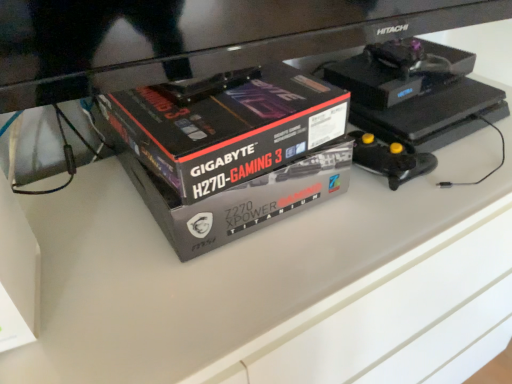
The image size is (512, 384). Describe the element at coordinates (226, 125) in the screenshot. I see `black glossy box at center, which is the 2th box in left-to-right order` at that location.

Identify the location of black glossy box at center, the 1th box when ordered from right to left. Image resolution: width=512 pixels, height=384 pixels. (226, 125).

Image resolution: width=512 pixels, height=384 pixels. What do you see at coordinates (17, 273) in the screenshot?
I see `matte black box at lower left, the second box when ordered from right to left` at bounding box center [17, 273].

The image size is (512, 384). I want to click on matte black box at lower left, the second box when ordered from right to left, so click(17, 273).

Locate an element on the screen. black glossy box at center, which is the 2th box in left-to-right order is located at coordinates (226, 125).

Considering the positions of objects matte black box at lower left, the second box when ordered from right to left, and black glossy box at center, which is the 2th box in left-to-right order, in the image provided, who is more to the left, matte black box at lower left, the second box when ordered from right to left, or black glossy box at center, which is the 2th box in left-to-right order,?

From the viewer's perspective, matte black box at lower left, the second box when ordered from right to left, appears more on the left side.

Which is behind, matte black box at lower left, the second box when ordered from right to left, or black glossy box at center, the 1th box when ordered from right to left?

black glossy box at center, the 1th box when ordered from right to left, is behind.

Between point (23, 291) and point (193, 192), which one is positioned behind?

The point (193, 192) is farther from the camera.

From the image's perspective, between matte black box at lower left, which is the first box from left to right, and black glossy box at center, the 1th box when ordered from right to left, which one is located above?

black glossy box at center, the 1th box when ordered from right to left, is shown above in the image.

From a real-world perspective, is matte black box at lower left, the second box when ordered from right to left, on black glossy box at center, the 1th box when ordered from right to left?

No, from a real-world perspective, matte black box at lower left, the second box when ordered from right to left, is not over black glossy box at center, the 1th box when ordered from right to left

Which object is thinner, matte black box at lower left, the second box when ordered from right to left, or black glossy box at center, which is the 2th box in left-to-right order?

matte black box at lower left, the second box when ordered from right to left.

In the scene shown: Is matte black box at lower left, which is the first box from left to right, shorter than black glossy box at center, the 1th box when ordered from right to left?

No.

Looking at this image, considering the sizes of objects matte black box at lower left, the second box when ordered from right to left, and black glossy box at center, which is the 2th box in left-to-right order, in the image provided, who is bigger, matte black box at lower left, the second box when ordered from right to left, or black glossy box at center, which is the 2th box in left-to-right order,?

black glossy box at center, which is the 2th box in left-to-right order.

Choose the correct answer: Is matte black box at lower left, which is the first box from left to right, inside black glossy box at center, the 1th box when ordered from right to left, or outside it?

matte black box at lower left, which is the first box from left to right, cannot be found inside black glossy box at center, the 1th box when ordered from right to left.

Is matte black box at lower left, which is the first box from left to right, next to black glossy box at center, which is the 2th box in left-to-right order?

No, matte black box at lower left, which is the first box from left to right, is not beside black glossy box at center, which is the 2th box in left-to-right order.

Is matte black box at lower left, which is the first box from left to right, positioned with its back to black glossy box at center, which is the 2th box in left-to-right order?

No, matte black box at lower left, which is the first box from left to right, is not facing the opposite direction of black glossy box at center, which is the 2th box in left-to-right order.

What's the angular difference between matte black box at lower left, which is the first box from left to right, and black glossy box at center, the 1th box when ordered from right to left,'s facing directions?

12 degrees separate the facing orientations of matte black box at lower left, which is the first box from left to right, and black glossy box at center, the 1th box when ordered from right to left.

Find the location of a particular element. The height and width of the screenshot is (384, 512). box above the matte black box at lower left, which is the first box from left to right (from the image's perspective) is located at coordinates (226, 125).

Is black glossy box at center, the 1th box when ordered from right to left, to the left or to the right of matte black box at lower left, which is the first box from left to right, in the image?

Based on their positions, black glossy box at center, the 1th box when ordered from right to left, is located to the right of matte black box at lower left, which is the first box from left to right.

Is black glossy box at center, which is the 2th box in left-to-right order, further to the viewer compared to matte black box at lower left, which is the first box from left to right?

Yes, it is behind matte black box at lower left, which is the first box from left to right.

Is point (321, 140) positioned in front of point (33, 274)?

No.

From the image's perspective, which one is positioned higher, black glossy box at center, the 1th box when ordered from right to left, or matte black box at lower left, the second box when ordered from right to left?

black glossy box at center, the 1th box when ordered from right to left, appears higher in the image.

From a real-world perspective, is black glossy box at center, the 1th box when ordered from right to left, above or below matte black box at lower left, the second box when ordered from right to left?

In terms of real-world spatial position, black glossy box at center, the 1th box when ordered from right to left, is above matte black box at lower left, the second box when ordered from right to left.

Considering the sizes of objects black glossy box at center, which is the 2th box in left-to-right order, and matte black box at lower left, which is the first box from left to right, in the image provided, who is wider, black glossy box at center, which is the 2th box in left-to-right order, or matte black box at lower left, which is the first box from left to right,?

With larger width is black glossy box at center, which is the 2th box in left-to-right order.

Does black glossy box at center, which is the 2th box in left-to-right order, have a greater height compared to matte black box at lower left, which is the first box from left to right?

In fact, black glossy box at center, which is the 2th box in left-to-right order, may be shorter than matte black box at lower left, which is the first box from left to right.

Between black glossy box at center, which is the 2th box in left-to-right order, and matte black box at lower left, the second box when ordered from right to left, which one has smaller size?

Smaller between the two is matte black box at lower left, the second box when ordered from right to left.

Can we say black glossy box at center, the 1th box when ordered from right to left, lies outside matte black box at lower left, the second box when ordered from right to left?

Absolutely, black glossy box at center, the 1th box when ordered from right to left, is external to matte black box at lower left, the second box when ordered from right to left.

Is black glossy box at center, which is the 2th box in left-to-right order, not near matte black box at lower left, which is the first box from left to right?

black glossy box at center, which is the 2th box in left-to-right order, is actually quite close to matte black box at lower left, which is the first box from left to right.

Is black glossy box at center, which is the 2th box in left-to-right order, facing away from matte black box at lower left, which is the first box from left to right?

black glossy box at center, which is the 2th box in left-to-right order, does not have its back to matte black box at lower left, which is the first box from left to right.

How many degrees apart are the facing directions of black glossy box at center, the 1th box when ordered from right to left, and matte black box at lower left, the second box when ordered from right to left?

The facing directions of black glossy box at center, the 1th box when ordered from right to left, and matte black box at lower left, the second box when ordered from right to left, are 12 degrees apart.

You are a GUI agent. You are given a task and a screenshot of the screen. Output one action in this format:
    pyautogui.click(x=<x>, y=<y>)
    Task: Click on the box above the matte black box at lower left, the second box when ordered from right to left (from a real-world perspective)
    
    Given the screenshot: What is the action you would take?
    pyautogui.click(x=226, y=125)

In order to click on box behind the matte black box at lower left, which is the first box from left to right in this screenshot , I will do `click(226, 125)`.

Where is `box lying above the matte black box at lower left, which is the first box from left to right (from the image's perspective)`? The height and width of the screenshot is (384, 512). box lying above the matte black box at lower left, which is the first box from left to right (from the image's perspective) is located at coordinates (226, 125).